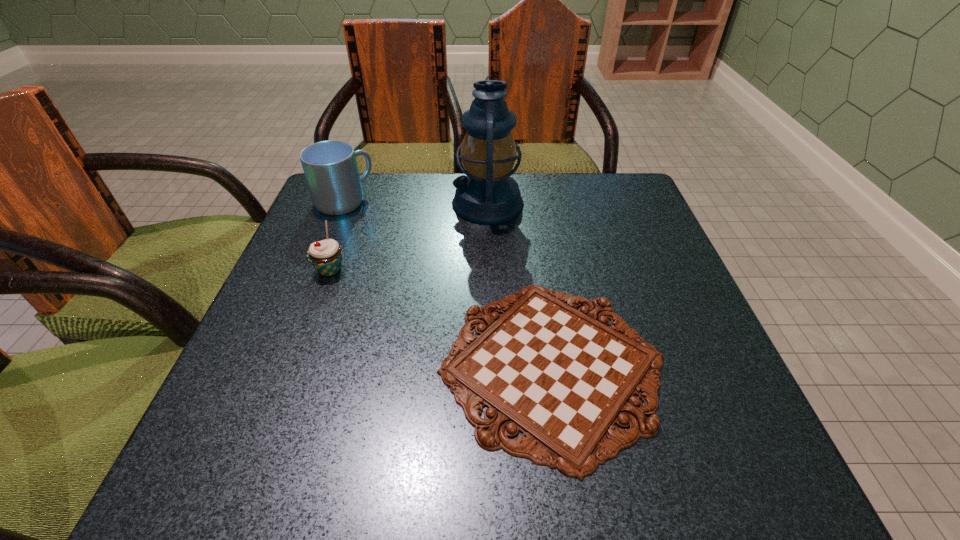
You are a GUI agent. You are given a task and a screenshot of the screen. Output one action in this format:
    pyautogui.click(x=<x>, y=<y>)
    Task: Click on the free space that is in between the tallest object and the mug
    The image size is (960, 540).
    Given the screenshot: What is the action you would take?
    pyautogui.click(x=416, y=202)

Where is `free area in between the cupcake and the mug`? free area in between the cupcake and the mug is located at coordinates (337, 235).

You are a GUI agent. You are given a task and a screenshot of the screen. Output one action in this format:
    pyautogui.click(x=<x>, y=<y>)
    Task: Click on the free space between the lantern and the shortest object
    
    Given the screenshot: What is the action you would take?
    pyautogui.click(x=519, y=284)

In order to click on free spot between the shortest object and the second nearest object in this screenshot , I will do `click(441, 318)`.

Find the location of a particular element. The height and width of the screenshot is (540, 960). vacant space in between the third farthest object and the shortest object is located at coordinates (441, 318).

Find the location of a particular element. Image resolution: width=960 pixels, height=540 pixels. free space between the shortest object and the lantern is located at coordinates (519, 284).

Point out which object is positioned as the third nearest to the shortest object. Please provide its 2D coordinates. Your answer should be formatted as a tuple, i.e. [(x, y)], where the tuple contains the x and y coordinates of a point satisfying the conditions above.

[(330, 167)]

Identify which object is the nearest to the nearest object. Please provide its 2D coordinates. Your answer should be formatted as a tuple, i.e. [(x, y)], where the tuple contains the x and y coordinates of a point satisfying the conditions above.

[(488, 195)]

In order to click on free region that satisfies the following two spatial constraints: 1. on the face of the shortest object; 2. on the right side of the tallest object in this screenshot , I will do `click(492, 365)`.

Where is `vacant space that satisfies the following two spatial constraints: 1. on the face of the chessboard; 2. on the left side of the tallest object`? This screenshot has height=540, width=960. vacant space that satisfies the following two spatial constraints: 1. on the face of the chessboard; 2. on the left side of the tallest object is located at coordinates (492, 365).